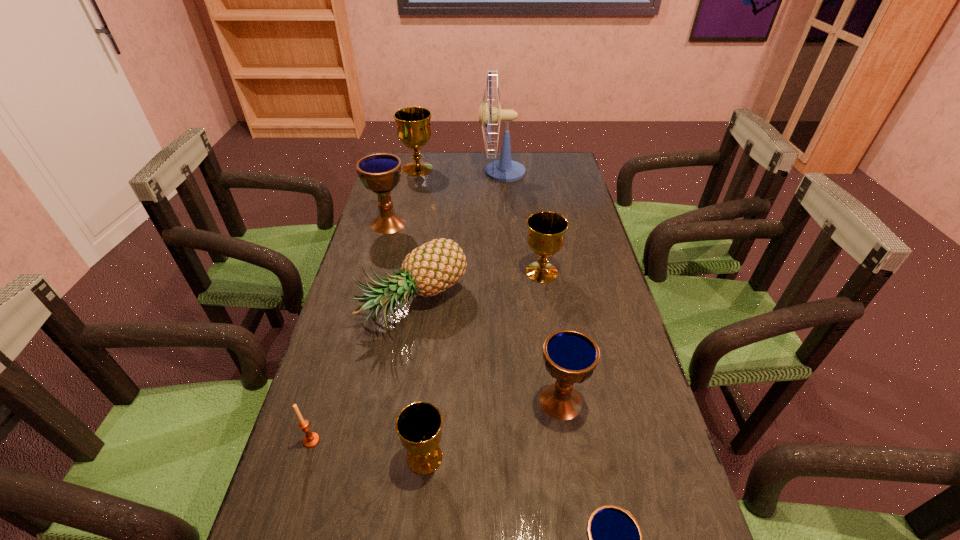
Locate an element on the screen. The height and width of the screenshot is (540, 960). vacant region at the left edge of the desktop is located at coordinates (385, 246).

The height and width of the screenshot is (540, 960). In the image, there is a desktop. Identify the location of free region at the right edge. (580, 302).

Locate an element on the screen. This screenshot has width=960, height=540. vacant region at the far left corner of the desktop is located at coordinates (414, 180).

Where is `free space at the far right corner of the desktop`? This screenshot has width=960, height=540. free space at the far right corner of the desktop is located at coordinates (533, 161).

You are a GUI agent. You are given a task and a screenshot of the screen. Output one action in this format:
    pyautogui.click(x=<x>, y=<y>)
    Task: Click on the vacant space in between the pineapple and the second farthest gold chalice
    Image resolution: width=960 pixels, height=540 pixels.
    Given the screenshot: What is the action you would take?
    pyautogui.click(x=478, y=288)

The width and height of the screenshot is (960, 540). I want to click on free point between the third chalice from left to right and the second farthest blue chalice, so click(492, 429).

The image size is (960, 540). Identify the location of free space between the rightmost gold chalice and the candle_holder. (426, 356).

This screenshot has width=960, height=540. In order to click on free space between the farthest chalice and the pineapple in this screenshot , I will do `click(417, 236)`.

Identify the location of empty location between the fourth farthest chalice and the tallest object. The width and height of the screenshot is (960, 540). (532, 287).

Identify the location of object that is the third closest to the pineapple. The image size is (960, 540). (570, 356).